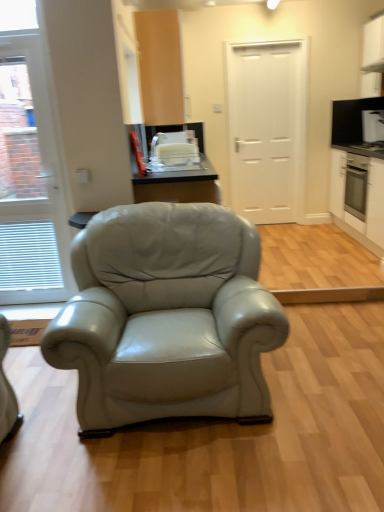
Question: From the image's perspective, is white glossy toaster at upper center, which ranks as the second appliance in back-to-front order, positioned above or below white glossy microwave at upper right, the 2th appliance positioned from the front?

Choices:
 (A) above
 (B) below

Answer: (B)

Question: Choose the correct answer: Is white glossy toaster at upper center, which is the second appliance in right-to-left order, inside white glossy microwave at upper right, which ranks as the first appliance in top-to-bottom order, or outside it?

Choices:
 (A) outside
 (B) inside

Answer: (A)

Question: Which is farther from the white glossy toaster at upper center, the first appliance ordered from the bottom?

Choices:
 (A) white glossy door at left, the 2th door viewed from the right
 (B) white glossy cabinet at right, the 1th cabinetry positioned from the right
 (C) white matte cabinet at right, marked as the second cabinetry in a left-to-right arrangement
 (D) white matte door at center, which is counted as the first door, starting from the right
 (E) matte wood cabinet at upper center, which is counted as the first cabinetry, starting from the left

Answer: (C)

Question: Estimate the real-world distances between objects in this image. Which object is closer to the white glossy door at left, marked as the 2th door in a back-to-front arrangement?

Choices:
 (A) white matte cabinet at right, marked as the second cabinetry in a left-to-right arrangement
 (B) matte wood cabinet at upper center, which is the 3th cabinetry in right-to-left order
 (C) white glossy cabinet at right, the 1th cabinetry positioned from the right
 (D) white matte door at center, acting as the second door starting from the front
 (E) white glossy toaster at upper center, which is the second appliance in right-to-left order

Answer: (E)